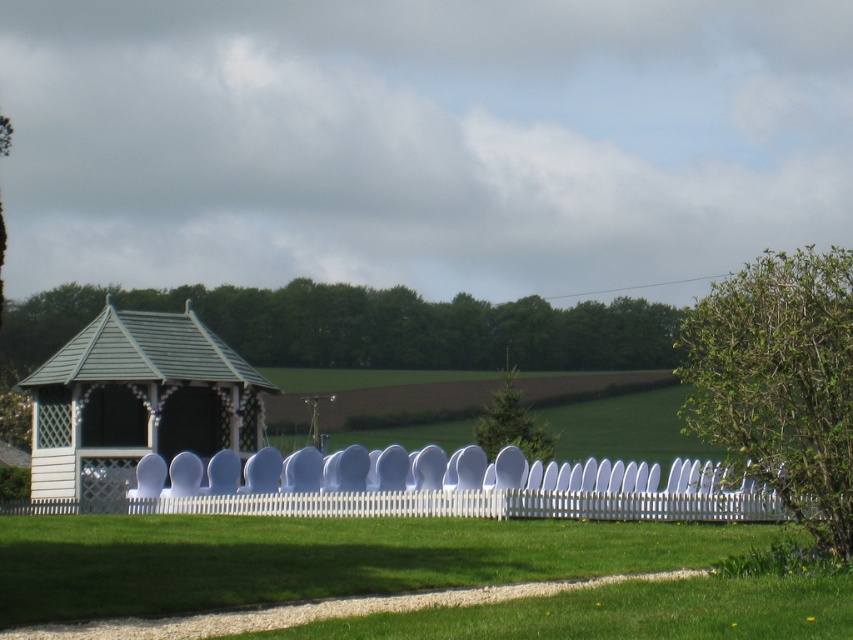
You are standing at the point marked as point (316, 557) in the image. What do you see immediately around you?

You see green grass at lower center immediately around you.

Looking at this image, you are a visitor at this rural location and want to walk from the gravel path to the white wood gazebo at left. Which direction should you go relative to the white picket fence at center?

You should walk to the left of the white picket fence at center because the white wood gazebo at left is positioned on the left side of the white picket fence at center.